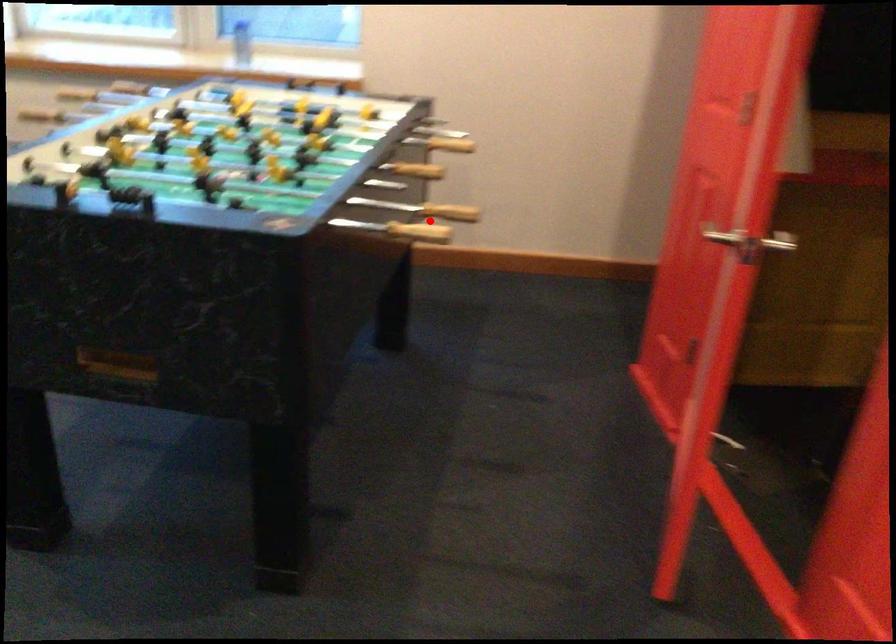
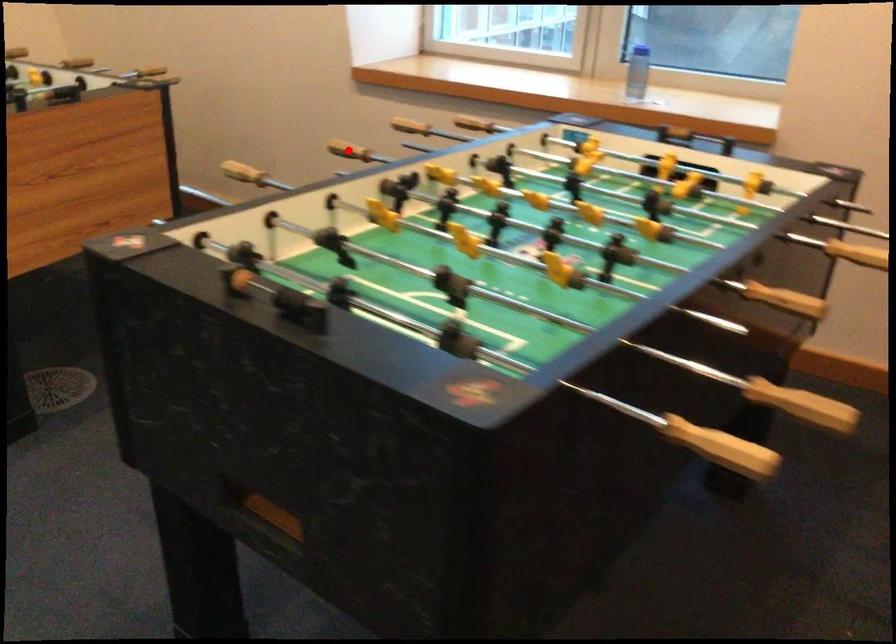
I am providing you with two images of the same scene from different viewpoints. A red point is marked on the first image and another point is marked on the second image. Do the highlighted points in image1 and image2 indicate the same real-world spot?

No